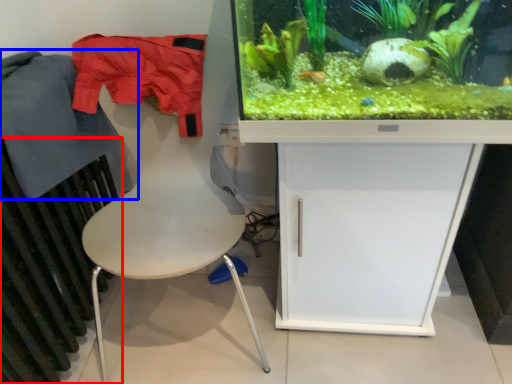
Question: Among these objects, which one is nearest to the camera, radiator (highlighted by a red box) or clothing (highlighted by a blue box)?

Choices:
 (A) radiator
 (B) clothing

Answer: (A)